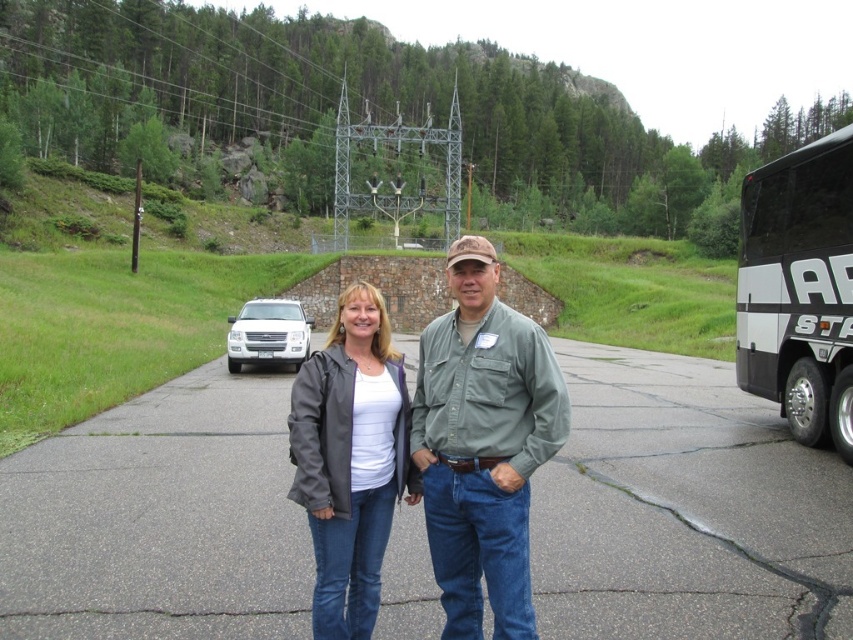
You are standing at the point marked by the coordinates point (799, 289) in the image. Looking around, you see a black white bus at right. What is the direction of the black white bus relative to your current position?

The black white bus at right is located to the right of your current position marked by point (799, 289).